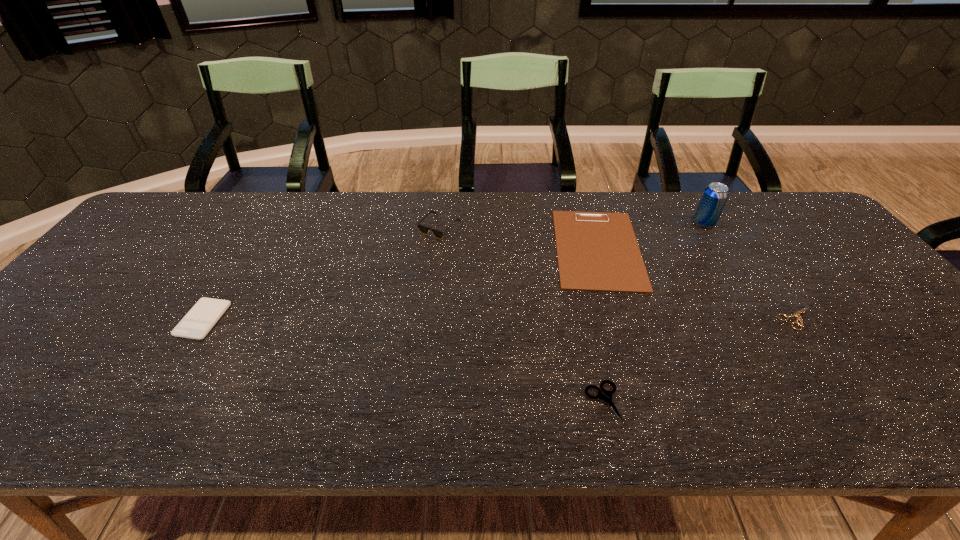
Identify the location of beer can. The image size is (960, 540). (714, 197).

Where is `the fifth object from right to left`? the fifth object from right to left is located at coordinates (423, 229).

You are a GUI agent. You are given a task and a screenshot of the screen. Output one action in this format:
    pyautogui.click(x=<x>, y=<y>)
    Task: Click on the sunglasses
    This screenshot has height=540, width=960.
    Given the screenshot: What is the action you would take?
    pyautogui.click(x=423, y=229)

Find the location of `clipboard`. clipboard is located at coordinates (597, 251).

Identify the location of the leftmost object. Image resolution: width=960 pixels, height=540 pixels. (196, 324).

Where is `the nearest object`? The image size is (960, 540). the nearest object is located at coordinates (607, 396).

Identify the location of the second shortest object. This screenshot has height=540, width=960. (607, 396).

Find the location of a particular element. The height and width of the screenshot is (540, 960). the shorter shears is located at coordinates (797, 314).

Identify the location of the shortest object. (797, 314).

Where is `free space located on the front of the beer can`? This screenshot has width=960, height=540. free space located on the front of the beer can is located at coordinates (739, 279).